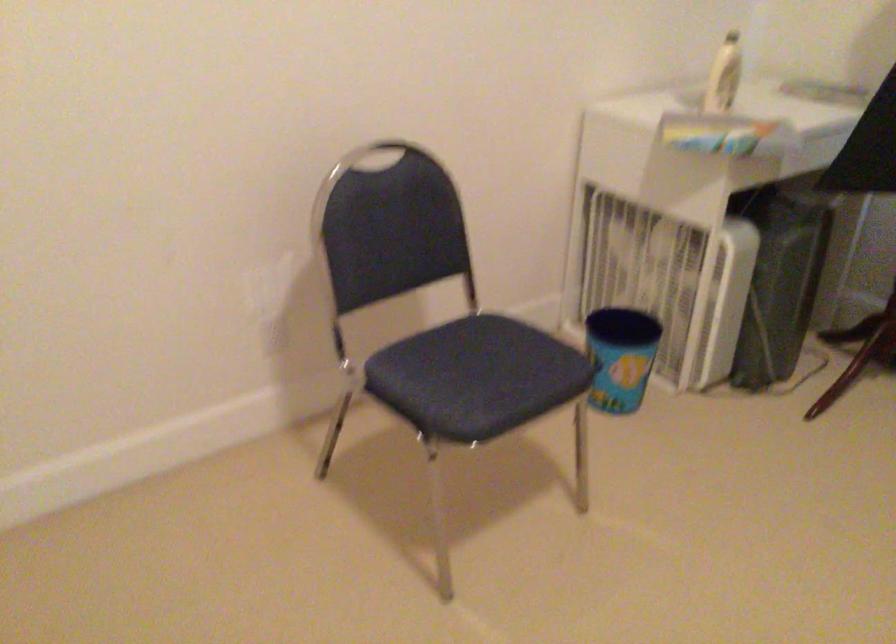
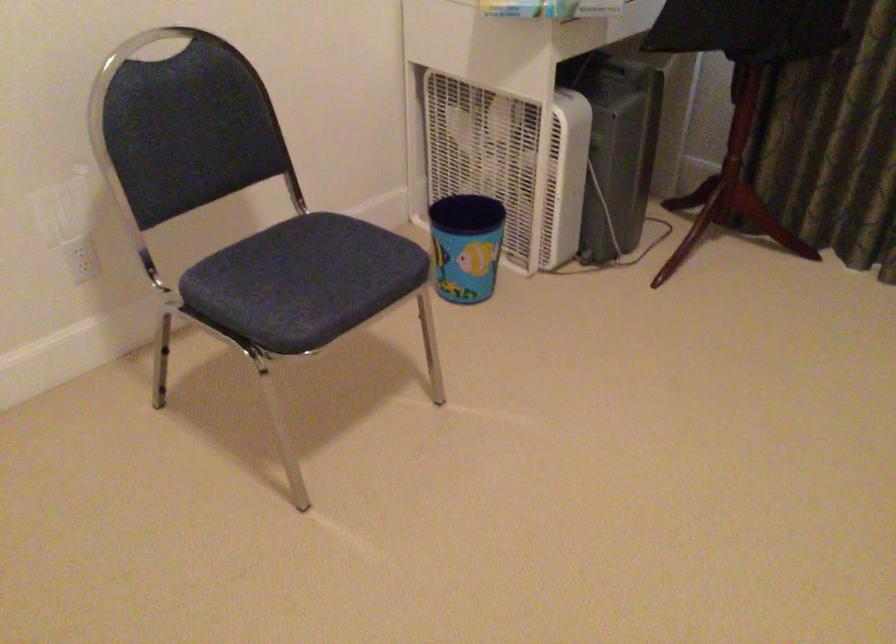
Which direction would the cameraman need to move to produce the second image?

The cameraman moved toward right, forward.